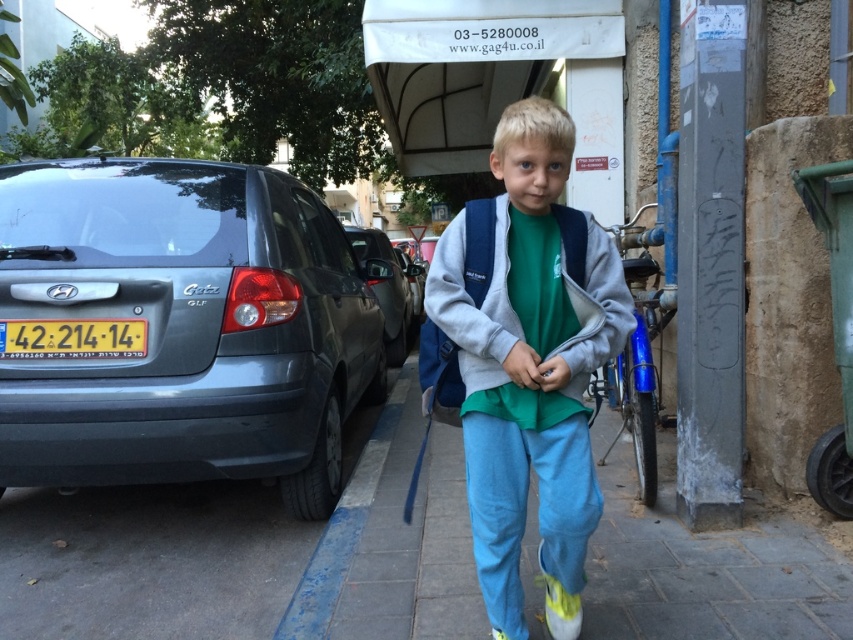
You are a delivery robot navigating an urban street scene. You need to deliver a package to the young boy standing on the sidewalk. The robot has a camera with a field of view that can only focus on objects within a 0.2 unit radius from the center point. If the robot is positioned at the origin point, can it focus on the yellow fabric shoe at lower center?

The yellow fabric shoe at lower center is located at point (560, 605). The distance from the origin to this point is sqrt0.948 squared plus 0.657 squared equals approximately 1.157 units. Since the robot can only focus within a 0.2 unit radius, it cannot focus on the yellow fabric shoe at lower center.

You are standing on the sidewalk and see two points marked on the ground in front of you. The first point is at coordinates point (572, 310) and the second point is at point (397, 248). Which point is closer to you?

Point (572, 310) is closer to the viewer than point (397, 248).

You are a delivery person trying to reach the matte gray sweatshirt at center. There is a matte gray car at left blocking your path. Can you walk around the car to get to the sweatshirt?

The matte gray car at left is positioned over the matte gray sweatshirt at center, so you cannot walk around the car to reach the sweatshirt because the car is directly blocking the path.